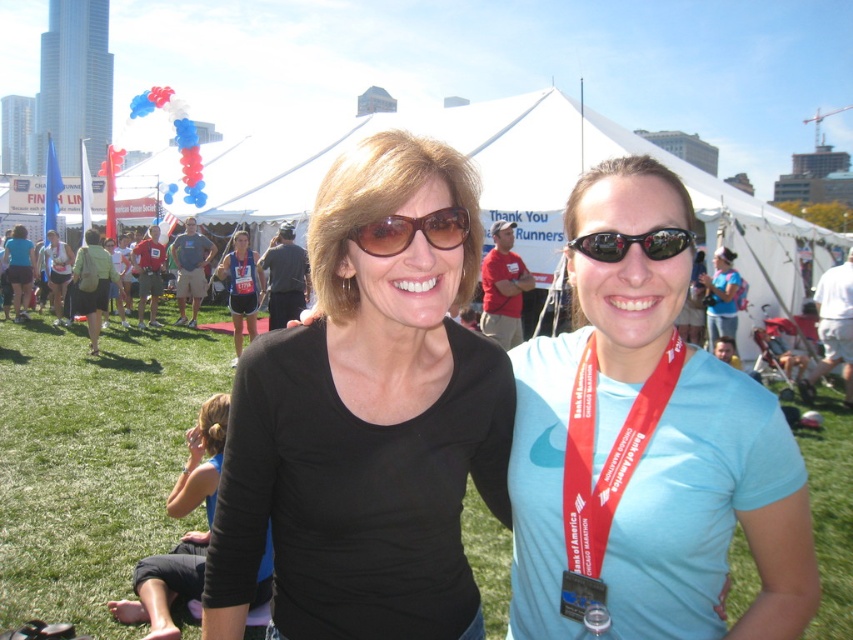
Does white fabric tent at center have a greater width compared to matte black tank top at center?

Yes, white fabric tent at center is wider than matte black tank top at center.

Can you confirm if white fabric tent at center is bigger than matte black tank top at center?

Correct, white fabric tent at center is larger in size than matte black tank top at center.

Is point (515, 172) positioned before point (42, 266)?

Yes, it is in front of point (42, 266).

I want to click on white fabric tent at center, so click(x=523, y=186).

This screenshot has width=853, height=640. In order to click on matte blue tank top at center in this screenshot , I will do `click(241, 285)`.

Is matte blue tank top at center in front of matte green backpack at left?

Yes, matte blue tank top at center is closer to the viewer.

Is point (238, 304) more distant than point (77, 257)?

No, it is in front of (77, 257).

Locate an element on the screen. matte blue tank top at center is located at coordinates (241, 285).

Which is in front, point (831, 598) or point (722, 237)?

Point (831, 598) is in front.

Is point (132, 356) behind point (537, 141)?

No, (132, 356) is closer to viewer.

Where is `green grass at center`? This screenshot has height=640, width=853. green grass at center is located at coordinates (91, 461).